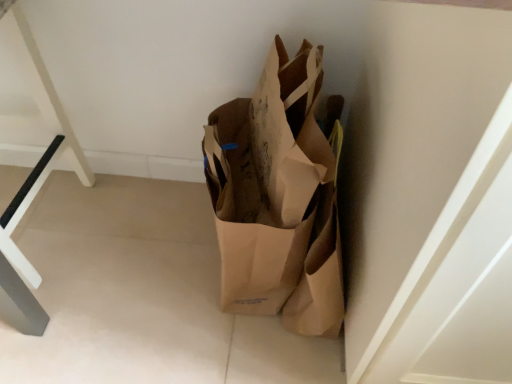
Locate an element on the screen. blank area to the left of brown paper bag at center is located at coordinates (144, 265).